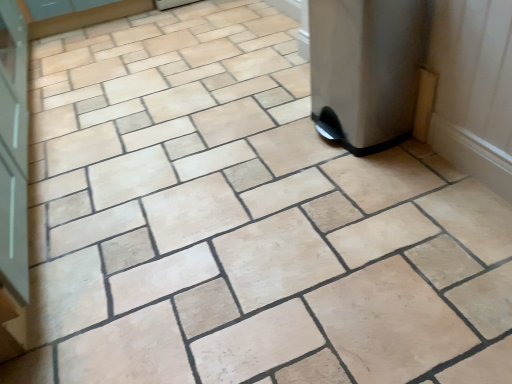
Where is `free region on the left part of metallic trash can at right`? The image size is (512, 384). free region on the left part of metallic trash can at right is located at coordinates (272, 147).